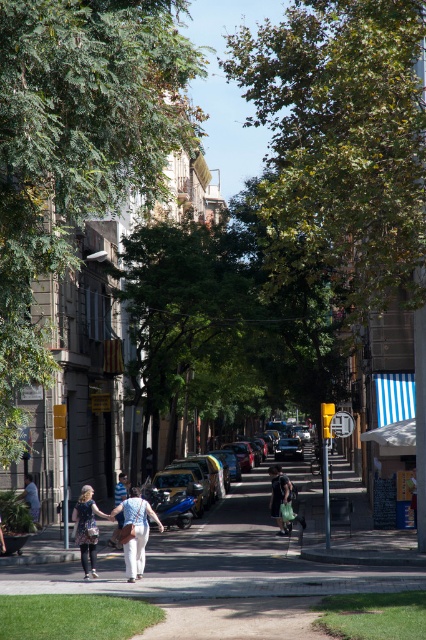
Question: Estimate the real-world distances between objects in this image. Which object is farther from the black matte jacket at center?

Choices:
 (A) light blue denim pants at center
 (B) denim skirt at center
 (C) smooth concrete sidewalk at center

Answer: (A)

Question: Which point is farther from the camera taking this photo?

Choices:
 (A) (146, 502)
 (B) (28, 497)
 (C) (270, 509)
 (D) (120, 524)

Answer: (C)

Question: Does black matte jacket at center appear over light blue shirt at center?

Choices:
 (A) yes
 (B) no

Answer: (A)

Question: Does smooth concrete sidewalk at center come behind light blue denim jacket at lower left?

Choices:
 (A) yes
 (B) no

Answer: (B)

Question: Which object appears farthest from the camera in this image?

Choices:
 (A) light blue denim pants at center
 (B) light blue shirt at center
 (C) light blue denim jacket at lower left

Answer: (C)

Question: Is denim skirt at center further to camera compared to black matte jacket at center?

Choices:
 (A) no
 (B) yes

Answer: (A)